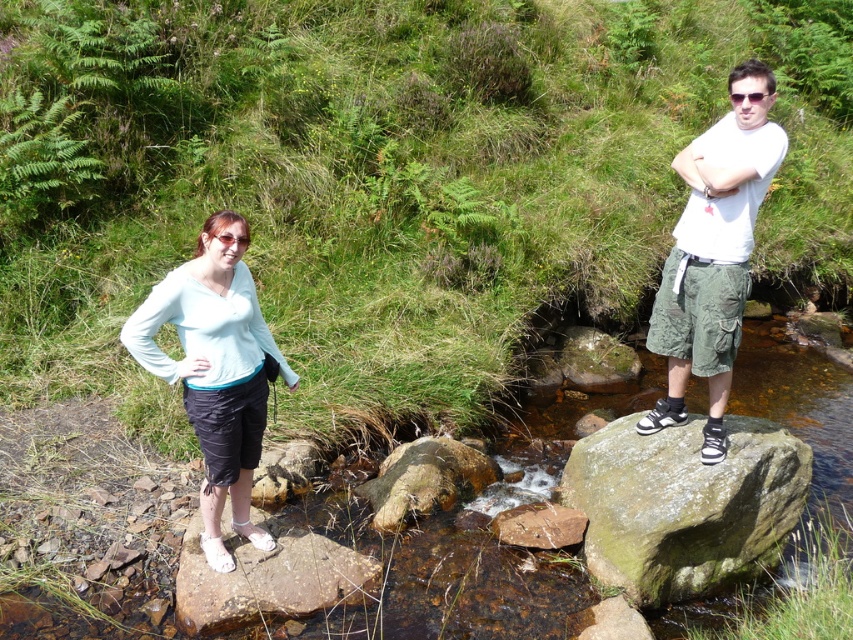
Is white matte t-shirt at center to the left of white matte skirt at left from the viewer's perspective?

In fact, white matte t-shirt at center is to the right of white matte skirt at left.

Based on the photo, does white matte t-shirt at center lie behind white matte skirt at left?

Yes.

Is point (727, 353) more distant than point (250, 304)?

Yes.

Identify the location of white matte t-shirt at center. The height and width of the screenshot is (640, 853). (712, 253).

Is green mossy rock at right behind white matte skirt at left?

That is True.

The height and width of the screenshot is (640, 853). Identify the location of green mossy rock at right. (683, 506).

Who is more forward, (779, 515) or (229, 484)?

Point (229, 484) is in front.

Where is `green mossy rock at right`? The image size is (853, 640). green mossy rock at right is located at coordinates (683, 506).

Measure the distance from green mossy rock at right to white matte t-shirt at center.

24.48 inches

Can you confirm if green mossy rock at right is taller than white matte t-shirt at center?

Incorrect, green mossy rock at right's height is not larger of white matte t-shirt at center's.

What do you see at coordinates (683, 506) in the screenshot? I see `green mossy rock at right` at bounding box center [683, 506].

Find the location of a particular element. The width and height of the screenshot is (853, 640). green mossy rock at right is located at coordinates (683, 506).